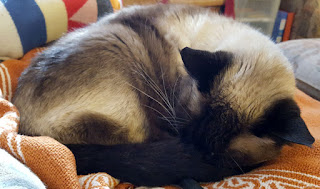
Identify the location of blanket. (301, 158), (55, 14).